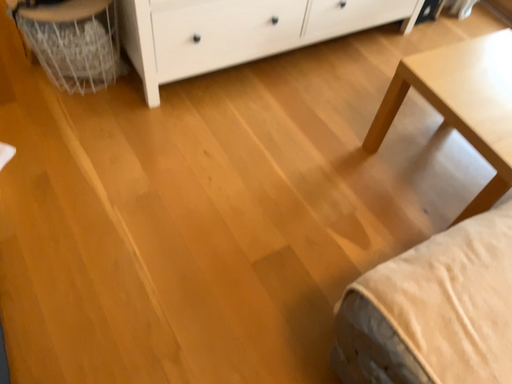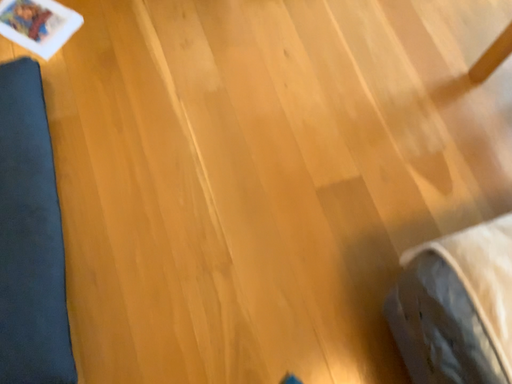
Question: Which way did the camera rotate in the video?

Choices:
 (A) rotated left
 (B) rotated right

Answer: (A)